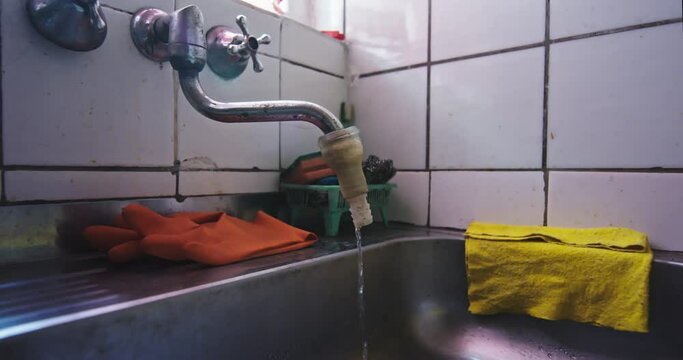
Identify the location of window. click(x=320, y=37).